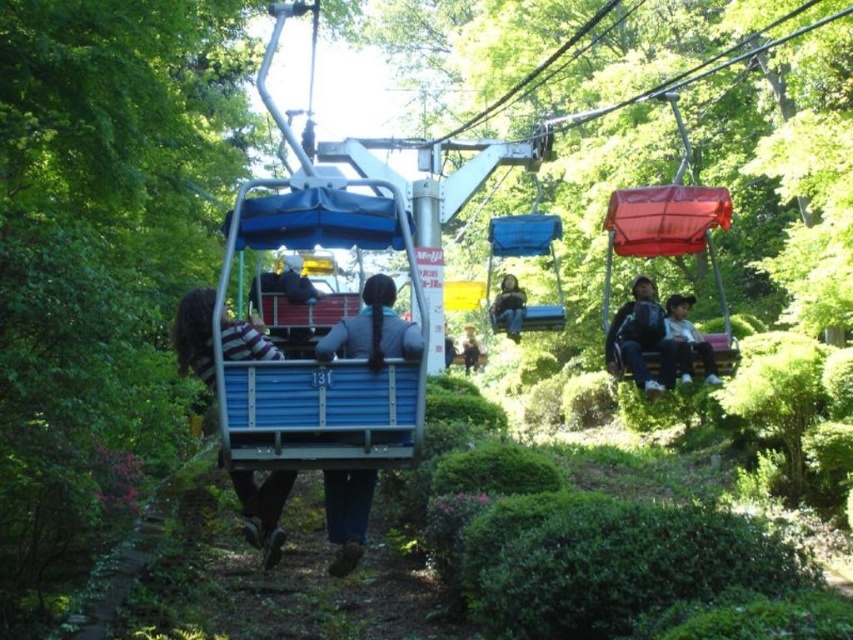
Which is in front, point (677, 298) or point (466, 369)?

Positioned in front is point (677, 298).

Locate an element on the screen. matte black jacket at right is located at coordinates (688, 339).

Who is lower down, striped fabric shirt at center or matte black jacket at right?

striped fabric shirt at center

Measure the distance between striped fabric shirt at center and matte black jacket at right.

striped fabric shirt at center and matte black jacket at right are 19.51 feet apart from each other.

This screenshot has height=640, width=853. In order to click on striped fabric shirt at center in this screenshot , I will do `click(263, 509)`.

Is the position of striped fabric shirt at center more distant than that of matte blue jacket at center?

No, striped fabric shirt at center is closer to the viewer.

Does point (183, 324) come in front of point (508, 280)?

Yes.

Does point (259, 540) come in front of point (512, 278)?

That is True.

This screenshot has height=640, width=853. Find the location of `striped fabric shirt at center`. striped fabric shirt at center is located at coordinates (263, 509).